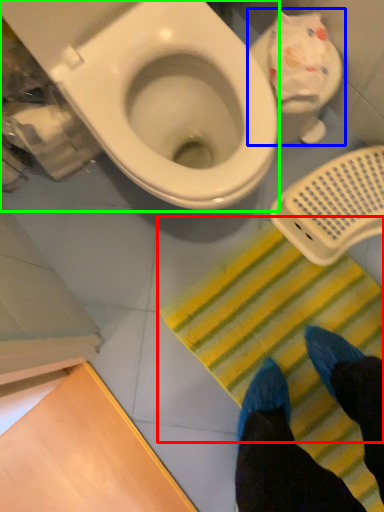
Question: Which object is positioned farthest from doormat (highlighted by a red box)? Select from toilet (highlighted by a blue box) and toilet (highlighted by a green box).

Choices:
 (A) toilet
 (B) toilet

Answer: (B)